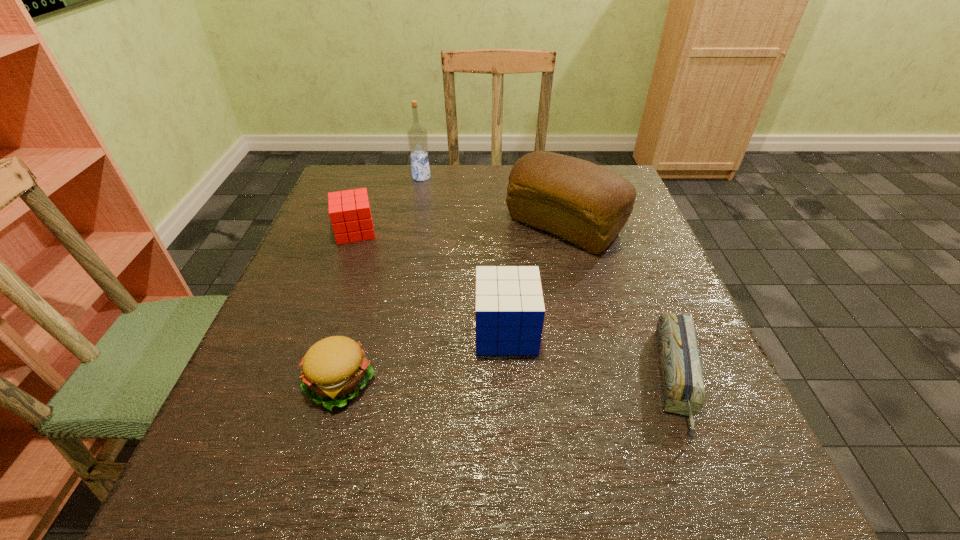
Where is `unoccupied area between the nearer cube and the vodka`? The height and width of the screenshot is (540, 960). unoccupied area between the nearer cube and the vodka is located at coordinates (464, 254).

Image resolution: width=960 pixels, height=540 pixels. In order to click on vacant space in between the third tallest object and the hamburger in this screenshot , I will do `click(423, 357)`.

Locate an element on the screen. Image resolution: width=960 pixels, height=540 pixels. vacant area that lies between the farthest object and the bread is located at coordinates (492, 201).

Locate an element on the screen. vacant area between the farthest object and the bread is located at coordinates (492, 201).

Locate an element on the screen. Image resolution: width=960 pixels, height=540 pixels. vacant area between the second tallest object and the hamburger is located at coordinates (452, 305).

Locate an element on the screen. This screenshot has height=540, width=960. free space that is in between the third tallest object and the left cube is located at coordinates (431, 281).

At what (x,y) coordinates should I click in order to perform the action: click on free spot between the nearer cube and the pencil box. Please return your answer as a coordinate pair (x, y). The image size is (960, 540). Looking at the image, I should click on (591, 355).

Find the location of `free point between the farther cube and the bread`. free point between the farther cube and the bread is located at coordinates (460, 228).

Locate an element on the screen. empty space that is in between the hamburger and the fifth shortest object is located at coordinates (452, 305).

Find the location of a particular element. object that is the closest one to the tallest object is located at coordinates (350, 215).